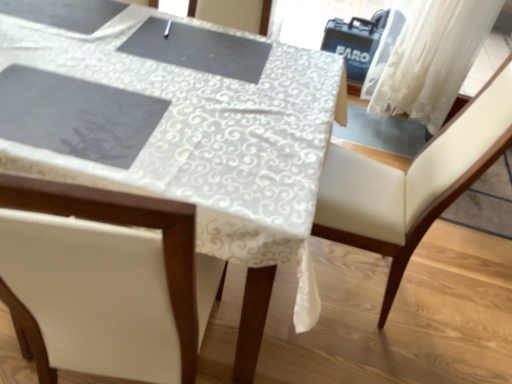
Question: Is white lace tablecloth at center taller than white leather chair at center?

Choices:
 (A) yes
 (B) no

Answer: (B)

Question: Is the position of white lace tablecloth at center less distant than that of white leather chair at center?

Choices:
 (A) no
 (B) yes

Answer: (B)

Question: Can you confirm if white lace tablecloth at center is thinner than white leather chair at center?

Choices:
 (A) no
 (B) yes

Answer: (A)

Question: Can you confirm if white lace tablecloth at center is positioned to the right of white leather chair at center?

Choices:
 (A) yes
 (B) no

Answer: (B)

Question: From a real-world perspective, does white lace tablecloth at center stand above white leather chair at center?

Choices:
 (A) yes
 (B) no

Answer: (B)

Question: Is white lace tablecloth at center further to camera compared to white leather chair at center?

Choices:
 (A) yes
 (B) no

Answer: (B)

Question: Is white lace tablecloth at center next to white sheer curtain at upper right?

Choices:
 (A) yes
 (B) no

Answer: (B)

Question: From the image's perspective, does white lace tablecloth at center appear lower than white sheer curtain at upper right?

Choices:
 (A) yes
 (B) no

Answer: (A)

Question: Does white lace tablecloth at center have a greater width compared to white sheer curtain at upper right?

Choices:
 (A) no
 (B) yes

Answer: (B)

Question: From a real-world perspective, does white lace tablecloth at center stand above white sheer curtain at upper right?

Choices:
 (A) yes
 (B) no

Answer: (B)

Question: Does white lace tablecloth at center have a greater height compared to white sheer curtain at upper right?

Choices:
 (A) no
 (B) yes

Answer: (A)

Question: Is white lace tablecloth at center looking in the opposite direction of white sheer curtain at upper right?

Choices:
 (A) yes
 (B) no

Answer: (A)

Question: Does white leather chair at center come behind white lace tablecloth at center?

Choices:
 (A) yes
 (B) no

Answer: (A)